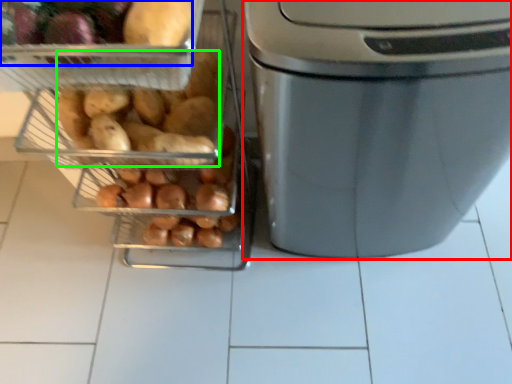
Question: Based on their relative distances, which object is nearer to home appliance (highlighted by a red box)? Choose from food (highlighted by a blue box) and sweet potato (highlighted by a green box).

Choices:
 (A) food
 (B) sweet potato

Answer: (B)